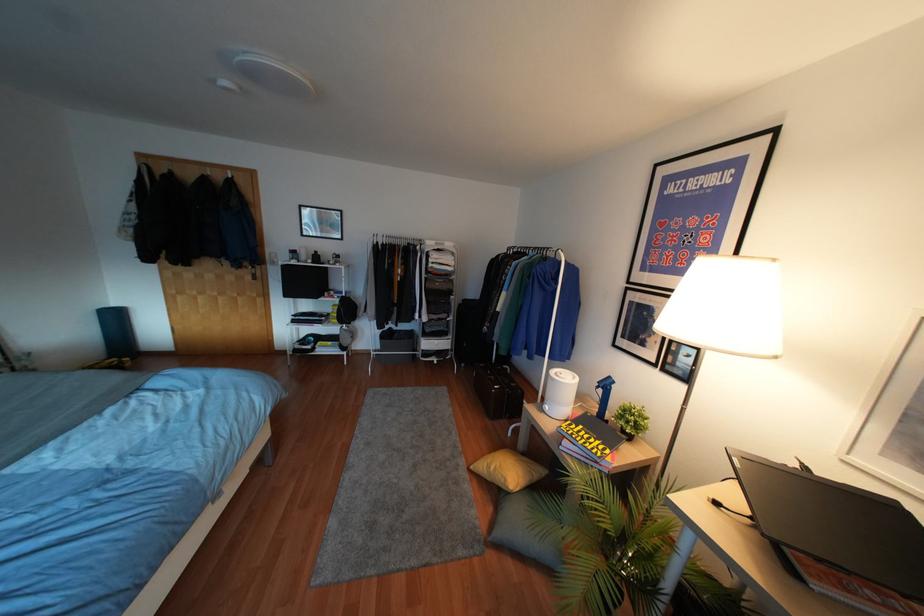
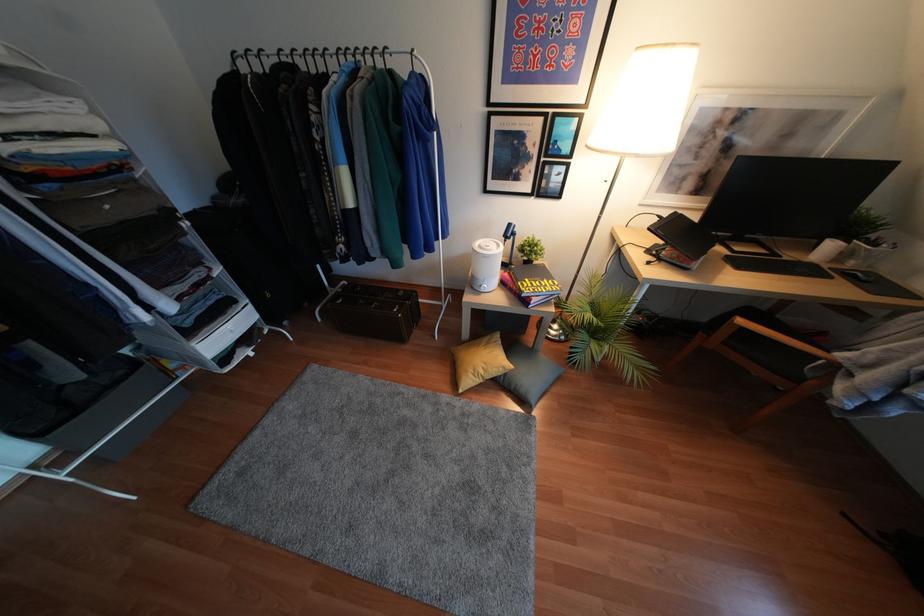
The point at (492, 468) is marked in the first image. Where is the corresponding point in the second image?

(480, 371)